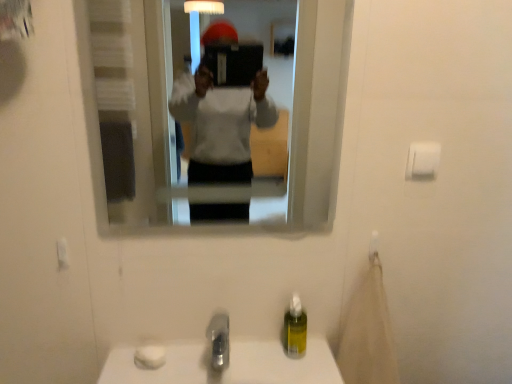
Question: Is clear glass mirror at upper center looking in the opposite direction of satin nickel faucet at lower center?

Choices:
 (A) yes
 (B) no

Answer: (B)

Question: Is clear glass mirror at upper center bigger than satin nickel faucet at lower center?

Choices:
 (A) yes
 (B) no

Answer: (A)

Question: Is clear glass mirror at upper center next to satin nickel faucet at lower center?

Choices:
 (A) no
 (B) yes

Answer: (A)

Question: From a real-world perspective, is clear glass mirror at upper center located higher than satin nickel faucet at lower center?

Choices:
 (A) yes
 (B) no

Answer: (A)

Question: From the image's perspective, is clear glass mirror at upper center under satin nickel faucet at lower center?

Choices:
 (A) no
 (B) yes

Answer: (A)

Question: Would you say satin nickel faucet at lower center is part of clear glass mirror at upper center's contents?

Choices:
 (A) no
 (B) yes

Answer: (A)

Question: Is white matte toilet paper at upper right facing away from clear glass mirror at upper center?

Choices:
 (A) no
 (B) yes

Answer: (A)

Question: Could you tell me if white matte toilet paper at upper right is turned towards clear glass mirror at upper center?

Choices:
 (A) no
 (B) yes

Answer: (A)

Question: Is white matte toilet paper at upper right not within clear glass mirror at upper center?

Choices:
 (A) no
 (B) yes

Answer: (B)

Question: Is clear glass mirror at upper center a part of white matte toilet paper at upper right?

Choices:
 (A) yes
 (B) no

Answer: (B)

Question: From a real-world perspective, is white matte toilet paper at upper right located beneath clear glass mirror at upper center?

Choices:
 (A) no
 (B) yes

Answer: (B)

Question: Does white matte toilet paper at upper right appear on the right side of clear glass mirror at upper center?

Choices:
 (A) yes
 (B) no

Answer: (A)

Question: Is white matte toilet paper at upper right at the right side of satin nickel faucet at lower center?

Choices:
 (A) yes
 (B) no

Answer: (A)